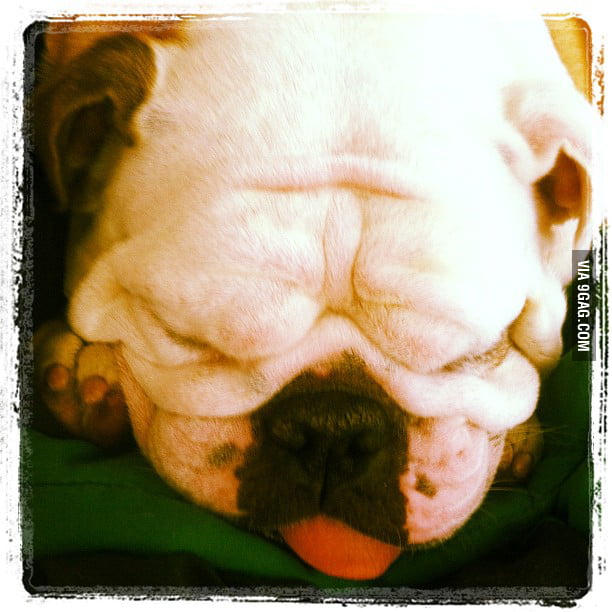
This screenshot has width=612, height=612. Identify the location of green blanket. (102, 524).